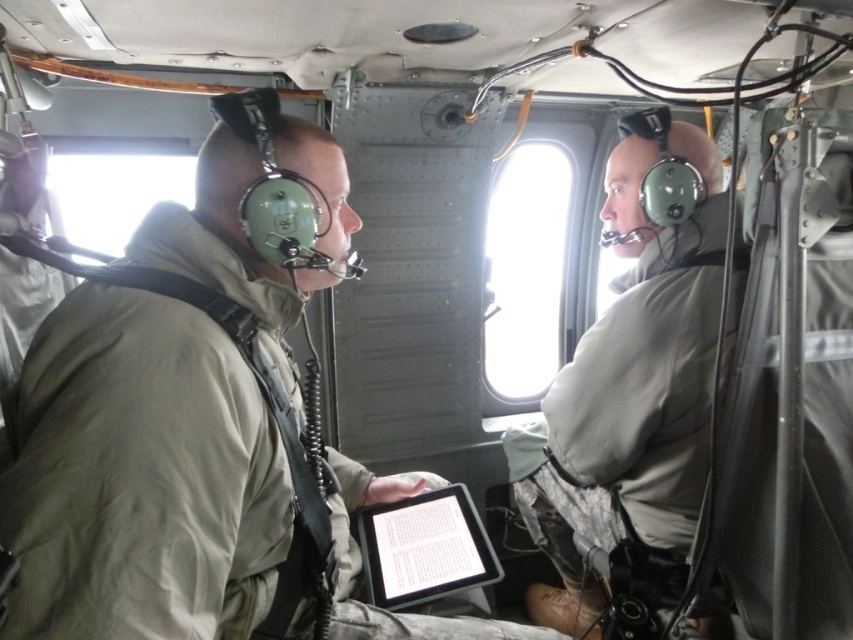
Question: Which object is farther from the camera taking this photo?

Choices:
 (A) black matte tablet at center
 (B) matte green helmet at center

Answer: (A)

Question: Which of the following is the closest to the observer?

Choices:
 (A) black matte tablet at center
 (B) matte green helmet at center

Answer: (B)

Question: Observing the image, what is the correct spatial positioning of matte green helmet at center in reference to black matte tablet at center?

Choices:
 (A) below
 (B) above

Answer: (A)

Question: Among these objects, which one is nearest to the camera?

Choices:
 (A) matte green helmet at center
 (B) black matte tablet at center

Answer: (A)

Question: Does matte green helmet at center come in front of black matte tablet at center?

Choices:
 (A) no
 (B) yes

Answer: (B)

Question: Is matte green helmet at center smaller than black matte tablet at center?

Choices:
 (A) no
 (B) yes

Answer: (A)